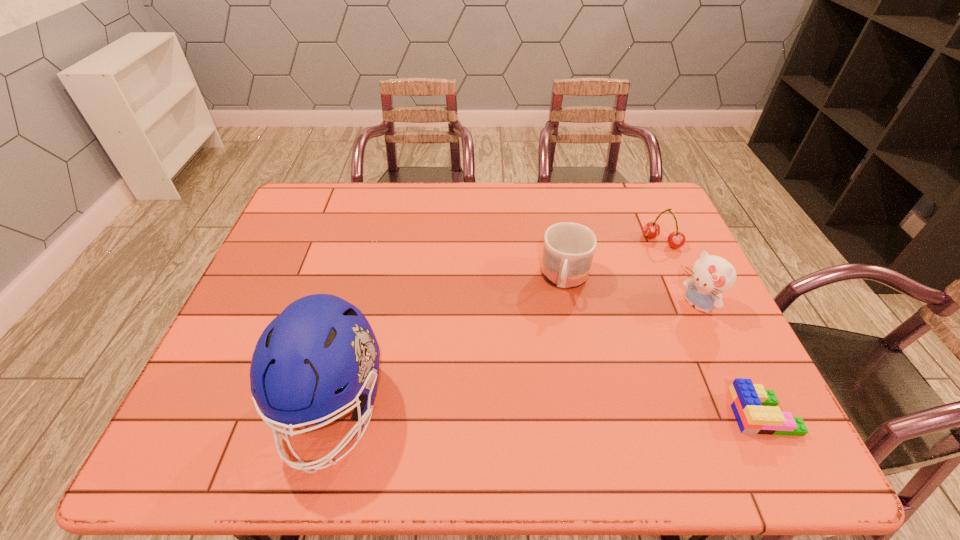
Identify the location of kitten at the right edge. (712, 275).

Find the location of a particular element. The image size is (960, 540). object located at the near right corner is located at coordinates (755, 408).

You are a GUI agent. You are given a task and a screenshot of the screen. Output one action in this format:
    pyautogui.click(x=<x>, y=<y>)
    Task: Click on the free space at the far edge of the desktop
    
    Given the screenshot: What is the action you would take?
    pyautogui.click(x=501, y=210)

This screenshot has width=960, height=540. In order to click on vacant space at the left edge in this screenshot , I will do `click(251, 316)`.

In the image, there is a desktop. Where is `vacant space at the right edge`? The height and width of the screenshot is (540, 960). vacant space at the right edge is located at coordinates (x=651, y=250).

What are the coordinates of `free spot at the far left corner of the desktop` in the screenshot? It's located at (x=326, y=191).

In order to click on vacant space at the near left corner in this screenshot , I will do `click(230, 411)`.

Where is `blank space at the far right corner of the desktop`? This screenshot has height=540, width=960. blank space at the far right corner of the desktop is located at coordinates pyautogui.click(x=647, y=215).

I want to click on vacant area that lies between the farthest object and the fourth object from right to left, so click(613, 261).

In order to click on vacant area between the Lego and the football helmet in this screenshot , I will do `click(547, 411)`.